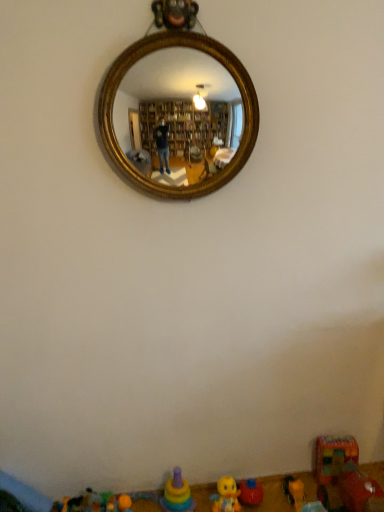
At what (x,y) coordinates should I click in order to perform the action: click on free space to the right of yellow plastic toy at lower right, which is the 6th toy from left to right. Please return your answer as a coordinate pair (x, y). Looking at the image, I should click on (319, 496).